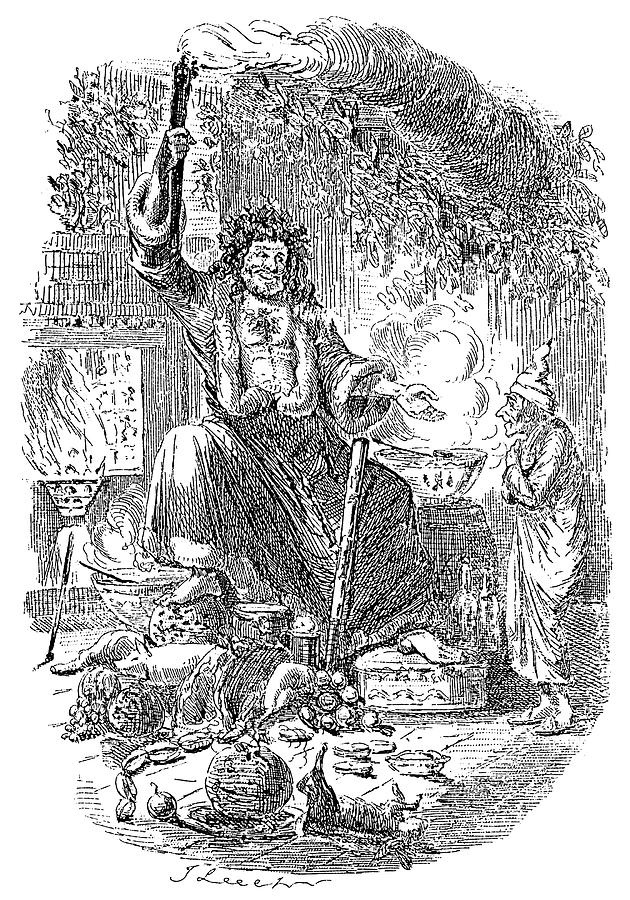
Find the location of a particular element. The image size is (630, 900). robe is located at coordinates (571, 514).